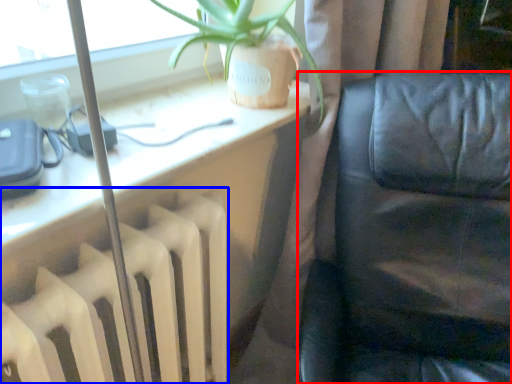
Question: Which object is further to the camera taking this photo, furniture (highlighted by a red box) or radiator (highlighted by a blue box)?

Choices:
 (A) furniture
 (B) radiator

Answer: (B)